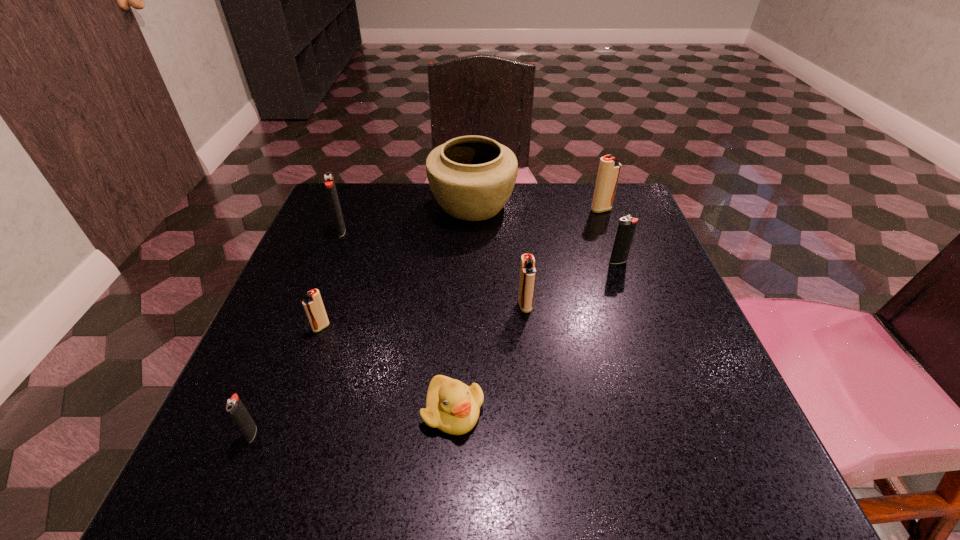
The image size is (960, 540). In order to click on pottery in this screenshot , I will do `click(472, 177)`.

In order to click on the farthest red igniter in this screenshot , I will do `click(609, 168)`.

Where is `the farthest igniter`? This screenshot has height=540, width=960. the farthest igniter is located at coordinates [x=609, y=168].

Locate an element on the screen. Image resolution: width=960 pixels, height=540 pixels. the biggest black igniter is located at coordinates (328, 177).

The image size is (960, 540). Identify the location of the farthest black igniter. (328, 177).

You are a GUI agent. You are given a task and a screenshot of the screen. Output one action in this format:
    pyautogui.click(x=<x>, y=<y>)
    Task: Click on the rightmost black igniter
    The image size is (960, 540).
    Given the screenshot: What is the action you would take?
    pyautogui.click(x=627, y=225)

Find the location of a particular element. the fourth nearest igniter is located at coordinates (627, 225).

Where is `the second smallest red igniter`? The width and height of the screenshot is (960, 540). the second smallest red igniter is located at coordinates (527, 269).

The height and width of the screenshot is (540, 960). Identify the location of the fourth igniter from left to right. (527, 269).

This screenshot has height=540, width=960. In order to click on the nearest red igniter in this screenshot , I will do `click(313, 305)`.